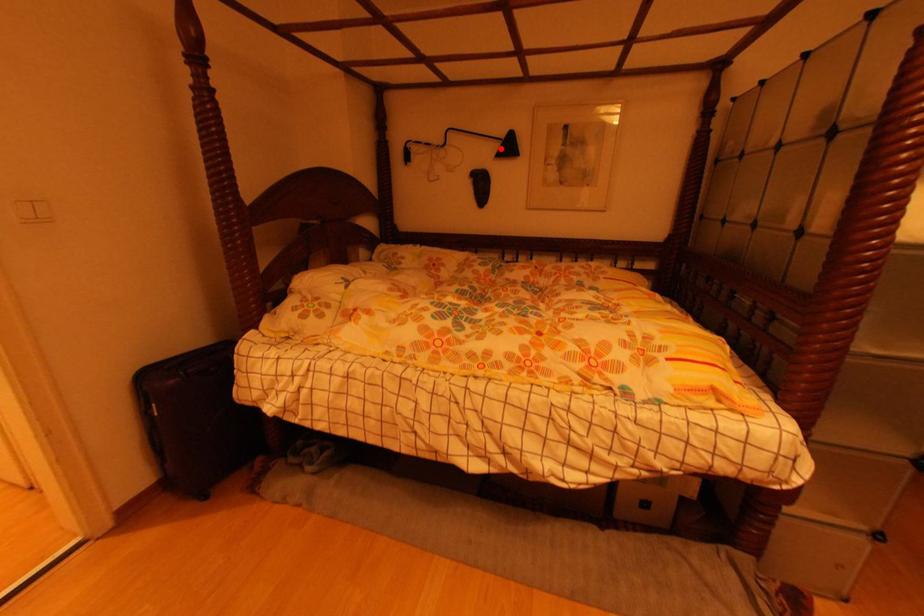
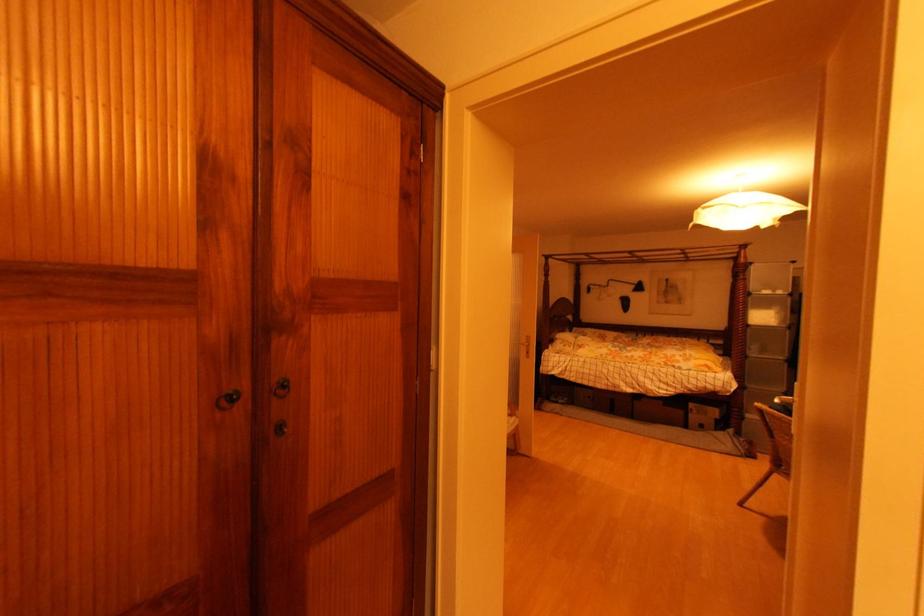
Question: I am providing you with two images of the same scene from different viewpoints. A red point is shown in image1. For the corresponding object point in image2, is it positioned nearer or farther from the camera?

Choices:
 (A) Nearer
 (B) Farther

Answer: (B)